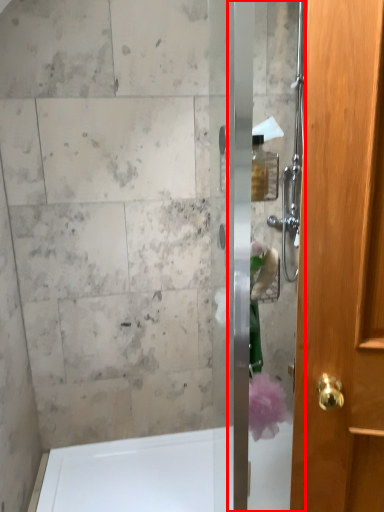
Question: From the image's perspective, what is the correct spatial positioning of screen door (annotated by the red box) in reference to bath?

Choices:
 (A) below
 (B) above

Answer: (B)